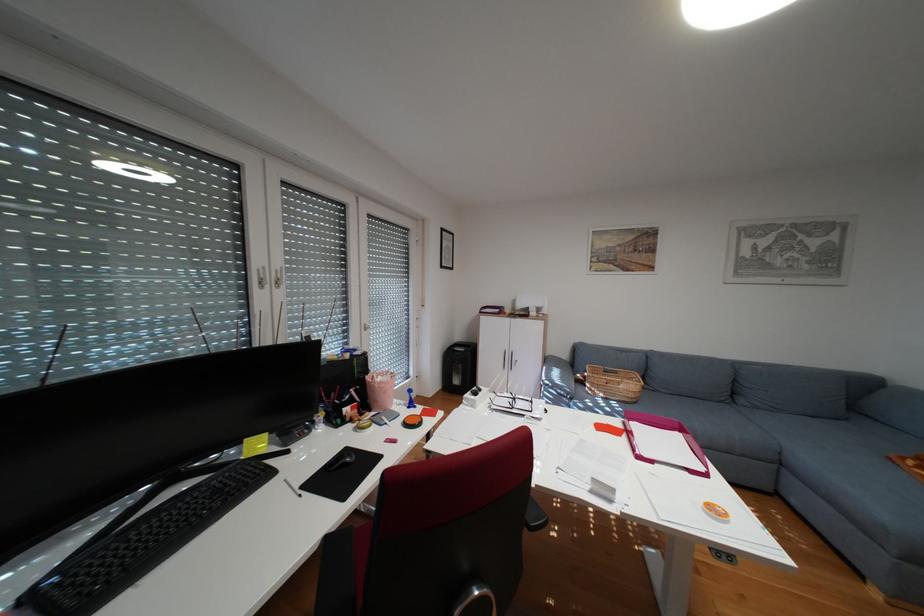
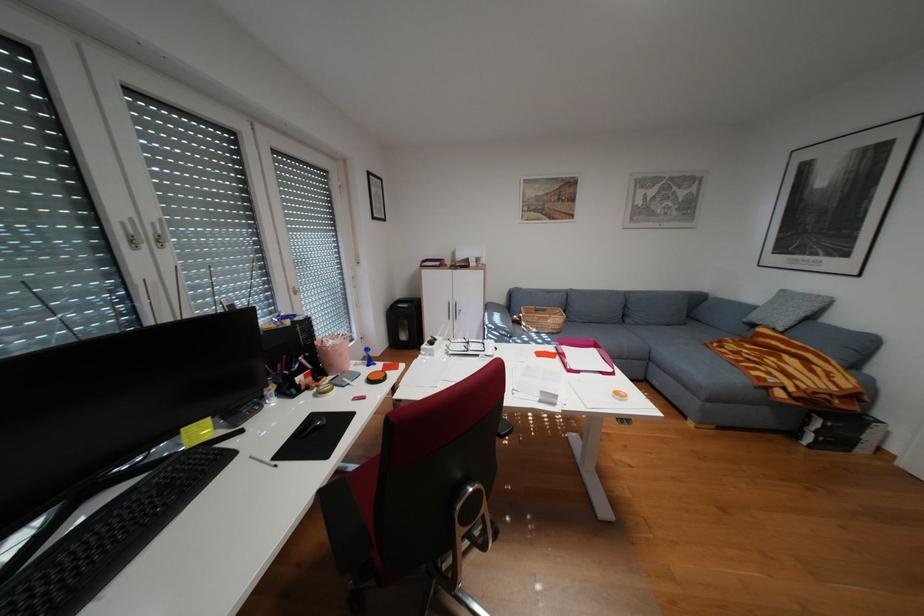
Locate, in the second image, the point that corresponds to pixel 747 426 in the first image.

(638, 339)